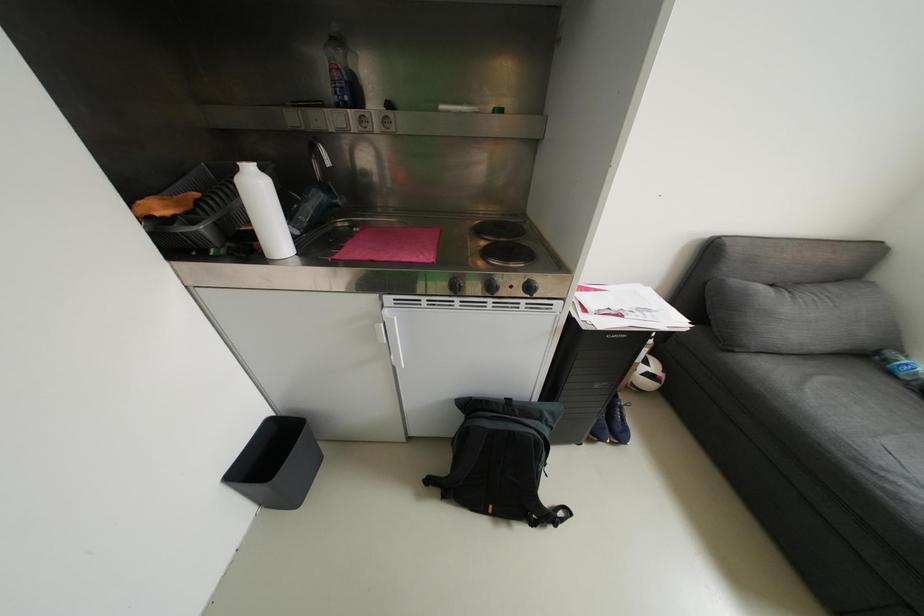
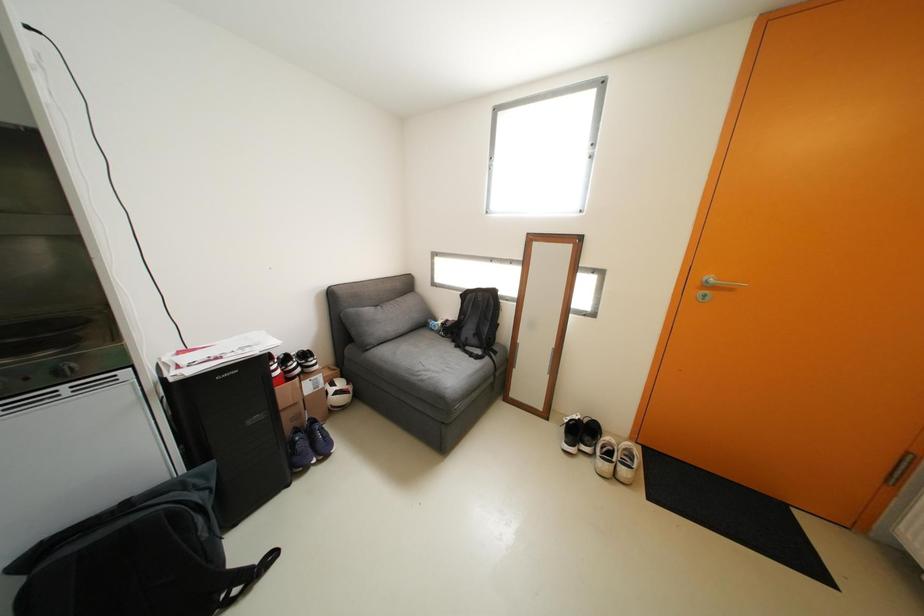
Question: The images are taken continuously from a first-person perspective. In which direction is your viewpoint rotating?

Choices:
 (A) Left
 (B) Right
 (C) Up
 (D) Down

Answer: (B)